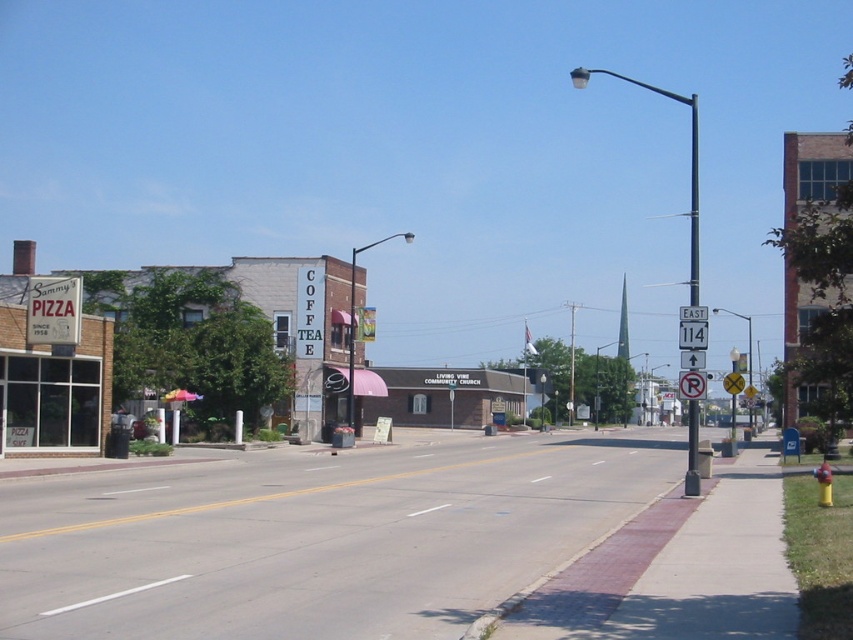
Which is above, white plastic street sign at upper right or metallic pole at right?

white plastic street sign at upper right is above.

What do you see at coordinates (689, 161) in the screenshot? This screenshot has height=640, width=853. I see `white plastic street sign at upper right` at bounding box center [689, 161].

Is point (694, 184) farther from camera compared to point (693, 269)?

Yes.

The image size is (853, 640). In order to click on white plastic street sign at upper right in this screenshot , I will do `click(689, 161)`.